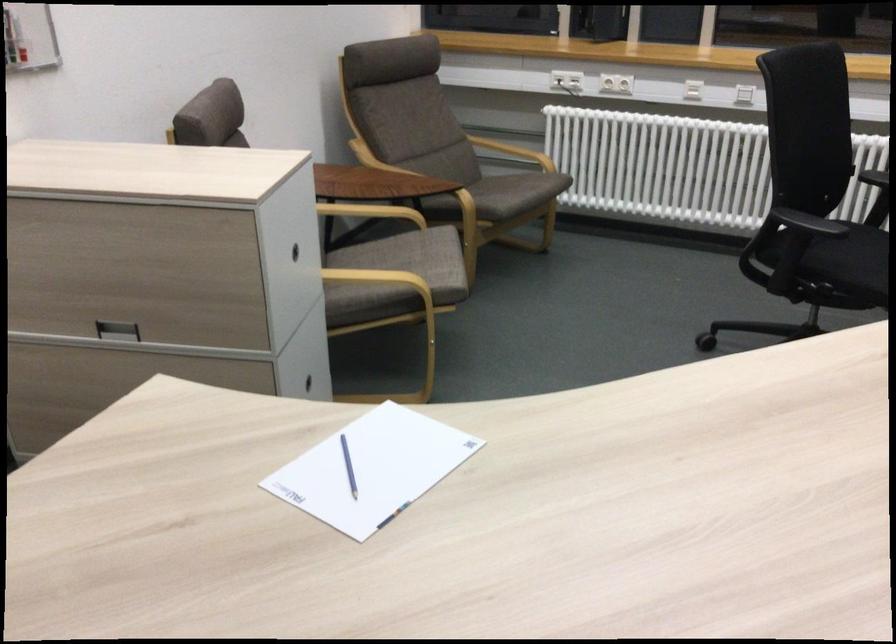
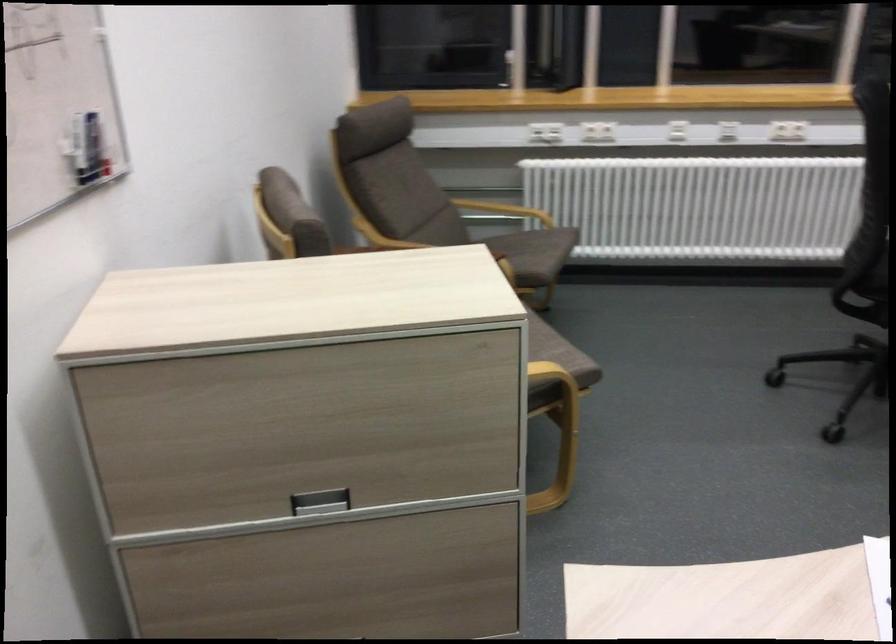
What movement of the cameraman would produce the second image?

The movement direction of the cameraman is left, forward.